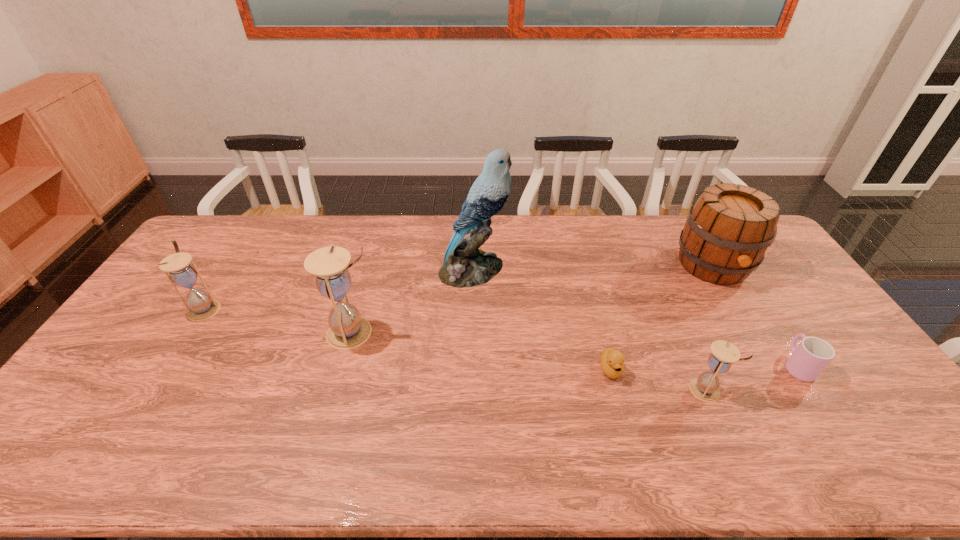
To achieve uniform spacing by inserting another hourglass among them, please point to a free space for this new hourglass. Please provide its 2D coordinates. Your answer should be formatted as a tuple, i.e. [(x, y)], where the tuple contains the x and y coordinates of a point satisfying the conditions above.

[(519, 360)]